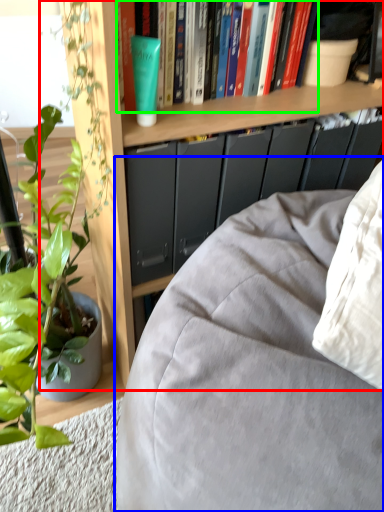
Question: Considering the real-world distances, which object is farthest from bookcase (highlighted by a red box)? studio couch (highlighted by a blue box) or book (highlighted by a green box)?

Choices:
 (A) studio couch
 (B) book

Answer: (A)